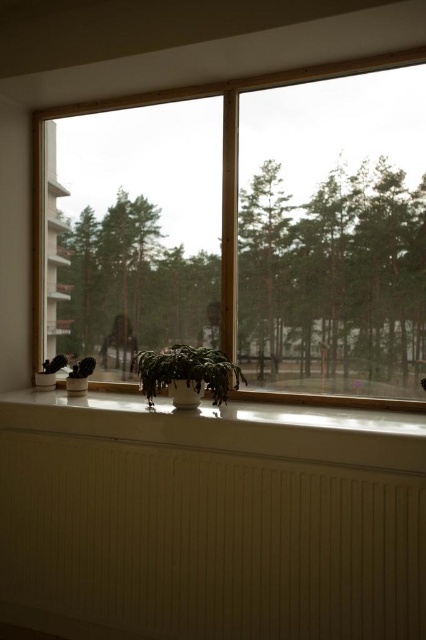
Is matte white windowsill at center smaller than green matte plant at center?

Incorrect, matte white windowsill at center is not smaller in size than green matte plant at center.

Is matte white windowsill at center below green matte plant at center?

No, matte white windowsill at center is not below green matte plant at center.

Locate an element on the screen. matte white windowsill at center is located at coordinates (244, 230).

Does white textured radiator at lower center have a greater height compared to green matte plant at center?

Yes.

Who is more distant from viewer, (311, 572) or (189, 346)?

Positioned behind is point (189, 346).

Between point (376, 604) and point (221, 376), which one is positioned behind?

The point (221, 376) is behind.

Where is `white textured radiator at lower center`? white textured radiator at lower center is located at coordinates (204, 544).

Who is more forward, (x=166, y=440) or (x=212, y=364)?

Point (x=166, y=440) is in front.

Which of these two, white glossy window sill at lower center or green matte plant at center, stands taller?

green matte plant at center

What do you see at coordinates (230, 428) in the screenshot? I see `white glossy window sill at lower center` at bounding box center [230, 428].

You are a GUI agent. You are given a task and a screenshot of the screen. Output one action in this format:
    pyautogui.click(x=<x>, y=<y>)
    Task: Click on the white glossy window sill at lower center
    
    Given the screenshot: What is the action you would take?
    pyautogui.click(x=230, y=428)